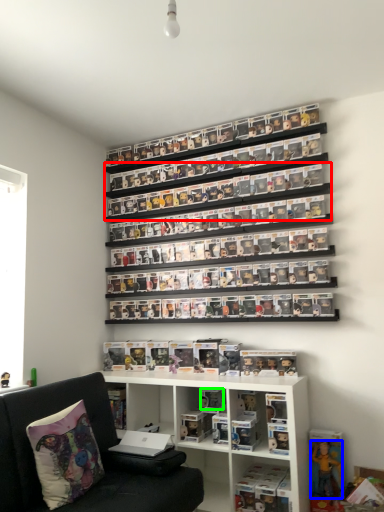
Question: Considering the real-world distances, which object is farthest from shelf (highlighted by a red box)? toy (highlighted by a blue box) or toy (highlighted by a green box)?

Choices:
 (A) toy
 (B) toy

Answer: (A)